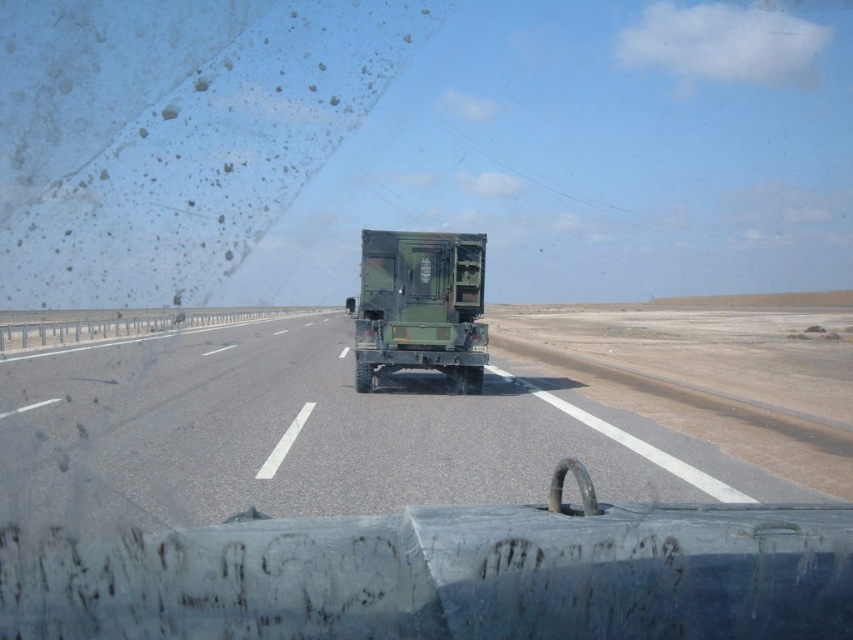
From the picture: You are driving a car and see the gray asphalt highway at center and the green matte trailer truck at center. Which one is positioned to the left from your perspective?

The gray asphalt highway at center is to the left of the green matte trailer truck at center.

You are driving a car and see the point marked at coordinates [314,433]. What does this point indicate on the gray asphalt highway at center?

The point marked at coordinates [314,433] indicates the location of the gray asphalt highway at center.

You are a driver who needs to make a quick turn to avoid an obstacle. Considering the gray asphalt highway at center and the green matte trailer truck at center, which one would allow you to maneuver more easily due to its size?

The gray asphalt highway at center has a larger size compared to the green matte trailer truck at center, so the highway provides more space for maneuvering.